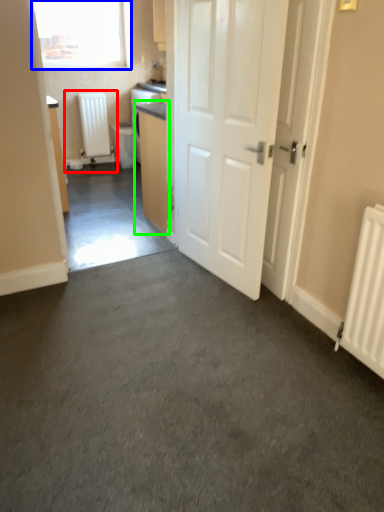
Question: Estimate the real-world distances between objects in this image. Which object is farther from water heater (highlighted by a red box), window (highlighted by a blue box) or cabinetry (highlighted by a green box)?

Choices:
 (A) window
 (B) cabinetry

Answer: (B)